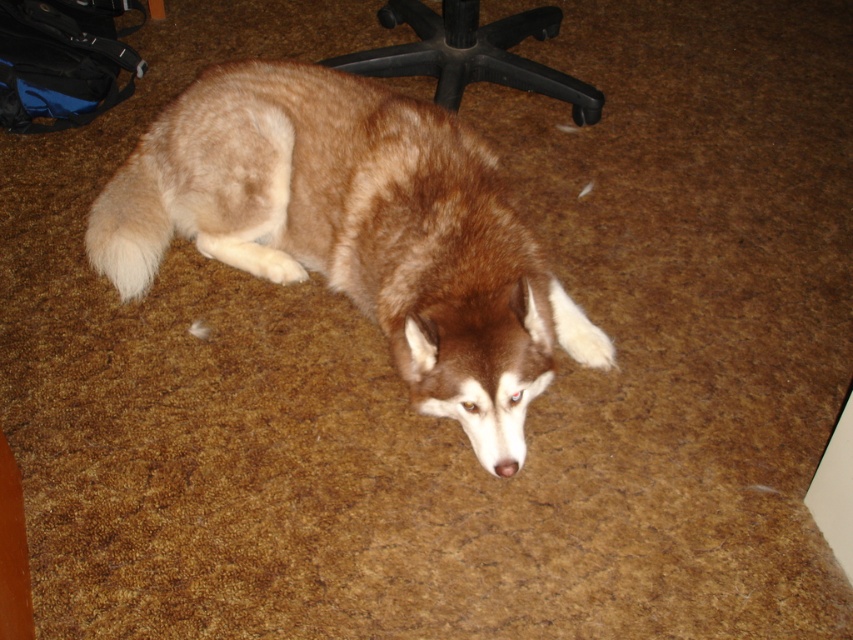
Which is behind, point (347, 84) or point (590, 90)?

Positioned behind is point (590, 90).

Does brown fur dog at center appear over black plastic swivel chair at upper center?

No.

The image size is (853, 640). What do you see at coordinates (357, 230) in the screenshot? I see `brown fur dog at center` at bounding box center [357, 230].

Locate an element on the screen. brown fur dog at center is located at coordinates (357, 230).